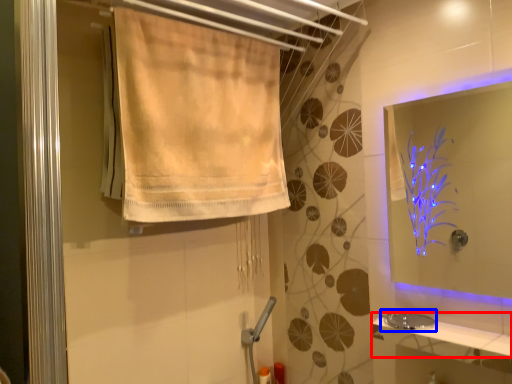
Question: Which point is further to the camera, counter top (highlighted by a red box) or sink (highlighted by a blue box)?

Choices:
 (A) counter top
 (B) sink

Answer: (B)